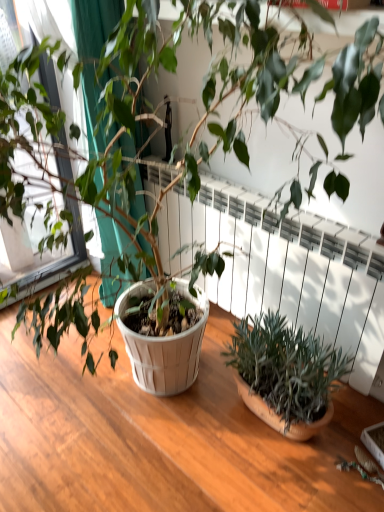
Question: From a real-world perspective, is green fabric at left physically above green matte plant at lower right?

Choices:
 (A) no
 (B) yes

Answer: (B)

Question: Is green fabric at left further to the viewer compared to green matte plant at lower right?

Choices:
 (A) no
 (B) yes

Answer: (B)

Question: From the image's perspective, is green fabric at left below green matte plant at lower right?

Choices:
 (A) yes
 (B) no

Answer: (B)

Question: Does green fabric at left have a lesser height compared to green matte plant at lower right?

Choices:
 (A) no
 (B) yes

Answer: (A)

Question: Is green fabric at left outside green matte plant at lower right?

Choices:
 (A) yes
 (B) no

Answer: (A)

Question: Is green fabric at left to the left or to the right of white textured radiator at center in the image?

Choices:
 (A) left
 (B) right

Answer: (A)

Question: Is green fabric at left inside the boundaries of white textured radiator at center, or outside?

Choices:
 (A) inside
 (B) outside

Answer: (B)

Question: In terms of height, does green fabric at left look taller or shorter compared to white textured radiator at center?

Choices:
 (A) short
 (B) tall

Answer: (B)

Question: Based on their sizes in the image, would you say green fabric at left is bigger or smaller than white textured radiator at center?

Choices:
 (A) small
 (B) big

Answer: (B)

Question: In terms of width, does green matte plant at lower right look wider or thinner when compared to green fabric at left?

Choices:
 (A) thin
 (B) wide

Answer: (A)

Question: Is green matte plant at lower right in front of or behind green fabric at left in the image?

Choices:
 (A) front
 (B) behind

Answer: (A)

Question: Is point (319, 384) positioned closer to the camera than point (52, 249)?

Choices:
 (A) closer
 (B) farther

Answer: (A)

Question: From a real-world perspective, is green matte plant at lower right above or below green fabric at left?

Choices:
 (A) above
 (B) below

Answer: (B)

Question: In terms of size, does green fabric at left appear bigger or smaller than green matte plant at lower right?

Choices:
 (A) big
 (B) small

Answer: (A)

Question: Which is correct: green fabric at left is inside green matte plant at lower right, or outside of it?

Choices:
 (A) outside
 (B) inside

Answer: (A)